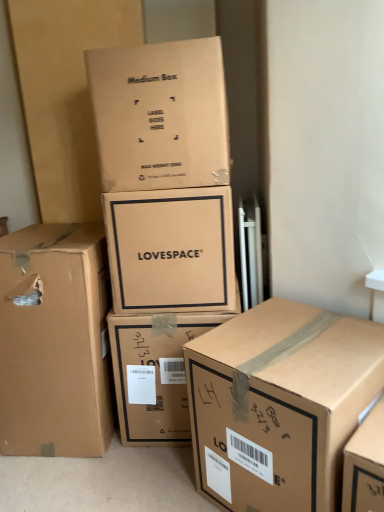
Question: Could you tell me if brown cardboard box at lower right, acting as the first box starting from the right, is turned towards matte cardboard box at center, the third box positioned from the left?

Choices:
 (A) yes
 (B) no

Answer: (B)

Question: Is brown cardboard box at lower right, marked as the 5th box in a left-to-right arrangement, wider than matte cardboard box at center, the third box positioned from the left?

Choices:
 (A) no
 (B) yes

Answer: (B)

Question: From a real-world perspective, is brown cardboard box at lower right, acting as the first box starting from the right, physically below matte cardboard box at center, marked as the third box in a right-to-left arrangement?

Choices:
 (A) yes
 (B) no

Answer: (A)

Question: Can you confirm if brown cardboard box at lower right, marked as the 5th box in a left-to-right arrangement, is smaller than matte cardboard box at center, marked as the third box in a right-to-left arrangement?

Choices:
 (A) yes
 (B) no

Answer: (B)

Question: Can you confirm if brown cardboard box at lower right, marked as the 5th box in a left-to-right arrangement, is shorter than matte cardboard box at center, marked as the third box in a right-to-left arrangement?

Choices:
 (A) no
 (B) yes

Answer: (A)

Question: Looking at the image, does matte cardboard box at center, marked as the third box in a right-to-left arrangement, seem bigger or smaller compared to brown cardboard box at upper center, marked as the fourth box in a right-to-left arrangement?

Choices:
 (A) small
 (B) big

Answer: (A)

Question: Is point (211, 304) closer or farther from the camera than point (92, 59)?

Choices:
 (A) closer
 (B) farther

Answer: (B)

Question: In the image, is matte cardboard box at center, the third box positioned from the left, on the left side or the right side of brown cardboard box at upper center, arranged as the 2th box when viewed from the left?

Choices:
 (A) right
 (B) left

Answer: (A)

Question: In terms of height, does matte cardboard box at center, the third box positioned from the left, look taller or shorter compared to brown cardboard box at upper center, marked as the fourth box in a right-to-left arrangement?

Choices:
 (A) short
 (B) tall

Answer: (A)

Question: Considering the positions of point (377, 394) and point (71, 307), is point (377, 394) closer or farther from the camera than point (71, 307)?

Choices:
 (A) farther
 (B) closer

Answer: (B)

Question: Would you say brown cardboard box at lower right, acting as the first box starting from the right, is inside or outside brown cardboard box at left, arranged as the fifth box when viewed from the right?

Choices:
 (A) outside
 (B) inside

Answer: (A)

Question: From a real-world perspective, is brown cardboard box at lower right, acting as the first box starting from the right, positioned above or below brown cardboard box at left, arranged as the fifth box when viewed from the right?

Choices:
 (A) above
 (B) below

Answer: (B)

Question: In the image, is brown cardboard box at lower right, acting as the first box starting from the right, positioned in front of or behind brown cardboard box at left, arranged as the fifth box when viewed from the right?

Choices:
 (A) behind
 (B) front

Answer: (B)

Question: Relative to brown cardboard box at lower right, acting as the first box starting from the right, is matte cardboard box at center, marked as the third box in a right-to-left arrangement, in front or behind?

Choices:
 (A) behind
 (B) front

Answer: (A)

Question: From a real-world perspective, is matte cardboard box at center, marked as the third box in a right-to-left arrangement, physically located above or below brown cardboard box at lower right, acting as the first box starting from the right?

Choices:
 (A) below
 (B) above

Answer: (B)